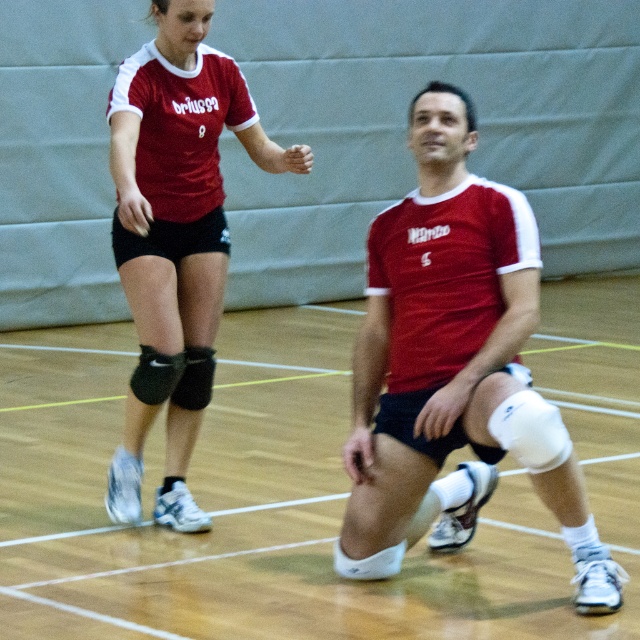
You are a volleyball coach observing the game. You notice the matte red jersey at upper left and the black matte knee pad at lower left. Which piece of equipment is covering the other?

The matte red jersey at upper left is positioned over the black matte knee pad at lower left, so the jersey is covering the knee pad.

You are a sports equipment inspector checking the dimensions of items in the gym. You see the matte red jersey at center and the black matte knee pad at lower left. Which item has a greater width?

The matte red jersey at center has a greater width than the black matte knee pad at lower left.

Where is the matte red jersey at center located in the gymnasium?

The matte red jersey at center is located at point coordinates of (452, 364) in the gymnasium.